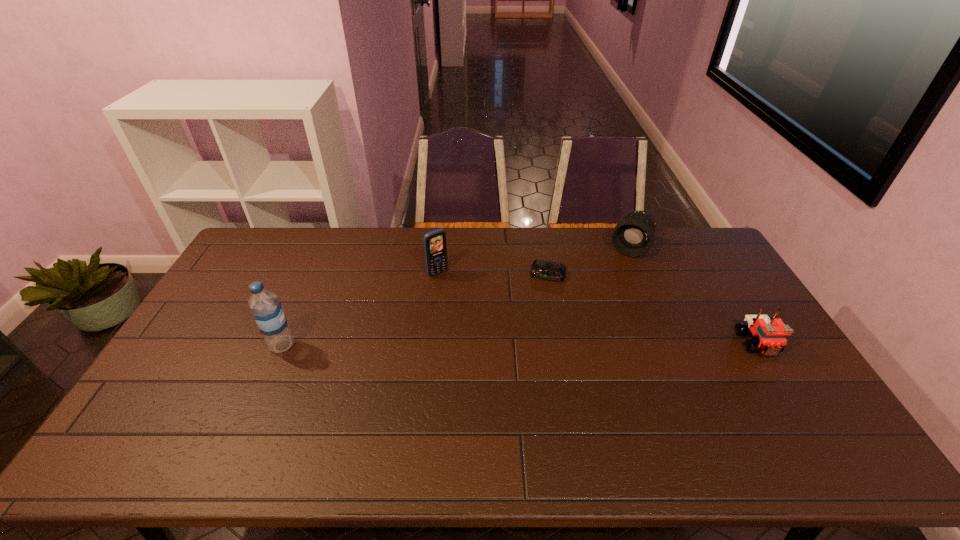
This screenshot has height=540, width=960. I want to click on free spot between the second object from right to left and the alarm clock, so click(589, 261).

The height and width of the screenshot is (540, 960). Identify the location of free space between the fourth tallest object and the third shortest object. (694, 296).

Where is `unoccupied area between the telephoto lens and the Lego`? The height and width of the screenshot is (540, 960). unoccupied area between the telephoto lens and the Lego is located at coordinates (694, 296).

The image size is (960, 540). In order to click on vacant point located between the farthest object and the fourth shortest object in this screenshot , I will do `click(534, 261)`.

Locate an element on the screen. This screenshot has width=960, height=540. blank region between the water bottle and the second shortest object is located at coordinates (520, 345).

Identify the location of vacant area that lies between the tallest object and the rightmost object. The width and height of the screenshot is (960, 540). (520, 345).

Where is `vacant space in between the fourth shortest object and the third object from right to left`? vacant space in between the fourth shortest object and the third object from right to left is located at coordinates (492, 274).

This screenshot has width=960, height=540. In order to click on free space between the fourth tallest object and the fourth shortest object in this screenshot , I will do `click(597, 309)`.

Locate an element on the screen. vacant space that's between the second shortest object and the leftmost object is located at coordinates (520, 345).

You are a GUI agent. You are given a task and a screenshot of the screen. Output one action in this format:
    pyautogui.click(x=<x>, y=<y>)
    Task: Click on the empty space that is in between the water bottle and the second tallest object
    Image resolution: width=960 pixels, height=540 pixels.
    Given the screenshot: What is the action you would take?
    pyautogui.click(x=360, y=309)